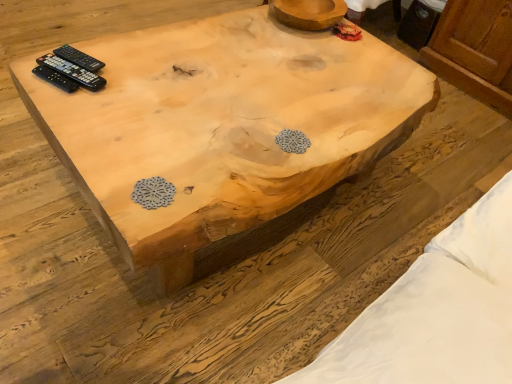
What is the approximate width of black plastic remote controls at upper left, the second remote control when ordered from front to back?

21.29 centimeters.

Measure the distance between point (245,202) and camera.

36.89 inches.

Where is `black plastic remote at upper left, the 3th remote control when ordered from back to front`? This screenshot has width=512, height=384. black plastic remote at upper left, the 3th remote control when ordered from back to front is located at coordinates (56, 79).

The width and height of the screenshot is (512, 384). In order to click on black plastic remote controls at upper left, the second remote control when ordered from front to back in this screenshot , I will do `click(72, 72)`.

Is black plastic remote control at upper left, arranged as the 3th remote control when viewed from the front, taller than natural wood coffee table at center?

Incorrect, the height of black plastic remote control at upper left, arranged as the 3th remote control when viewed from the front, is not larger of that of natural wood coffee table at center.

From the image's perspective, which one is positioned lower, black plastic remote control at upper left, the first remote control positioned from the back, or natural wood coffee table at center?

natural wood coffee table at center, from the image's perspective.

Is black plastic remote control at upper left, arranged as the 3th remote control when viewed from the front, facing away from natural wood coffee table at center?

No, black plastic remote control at upper left, arranged as the 3th remote control when viewed from the front, is not facing the opposite direction of natural wood coffee table at center.

Which object is closer to the camera taking this photo, black plastic remote control at upper left, arranged as the 3th remote control when viewed from the front, or natural wood coffee table at center?

Positioned in front is natural wood coffee table at center.

From the image's perspective, is natural wood coffee table at center on top of black plastic remote control at upper left, arranged as the 3th remote control when viewed from the front?

No, from the image's perspective, natural wood coffee table at center is not above black plastic remote control at upper left, arranged as the 3th remote control when viewed from the front.

From a real-world perspective, which is physically below, natural wood coffee table at center or black plastic remote control at upper left, the first remote control positioned from the back?

In real-world perspective, natural wood coffee table at center is lower.

Considering the sizes of natural wood coffee table at center and black plastic remote control at upper left, arranged as the 3th remote control when viewed from the front, in the image, is natural wood coffee table at center wider or thinner than black plastic remote control at upper left, arranged as the 3th remote control when viewed from the front,?

natural wood coffee table at center is wider than black plastic remote control at upper left, arranged as the 3th remote control when viewed from the front.

Are natural wood coffee table at center and black plastic remote controls at upper left, the second remote control when ordered from front to back, making contact?

natural wood coffee table at center and black plastic remote controls at upper left, the second remote control when ordered from front to back, are clearly separated.

Is point (150, 49) behind point (76, 73)?

Yes, point (150, 49) is behind point (76, 73).

Does natural wood coffee table at center contain black plastic remote controls at upper left, the second remote control when ordered from front to back?

Definitely not — black plastic remote controls at upper left, the second remote control when ordered from front to back, is not inside natural wood coffee table at center.

From a real-world perspective, is black plastic remote at upper left, arranged as the first remote control when viewed from the front, positioned over natural wood coffee table at center based on gravity?

Yes, from a real-world perspective, black plastic remote at upper left, arranged as the first remote control when viewed from the front, is over natural wood coffee table at center

Considering the relative sizes of black plastic remote at upper left, arranged as the first remote control when viewed from the front, and natural wood coffee table at center in the image provided, is black plastic remote at upper left, arranged as the first remote control when viewed from the front, smaller than natural wood coffee table at center?

Correct, black plastic remote at upper left, arranged as the first remote control when viewed from the front, occupies less space than natural wood coffee table at center.

Is black plastic remote at upper left, the 3th remote control when ordered from back to front, oriented towards natural wood coffee table at center?

No, black plastic remote at upper left, the 3th remote control when ordered from back to front, is not turned towards natural wood coffee table at center.

Is black plastic remote controls at upper left, the second remote control from the back, placed right next to black plastic remote control at upper left, arranged as the 3th remote control when viewed from the front?

Yes, black plastic remote controls at upper left, the second remote control from the back, is in contact with black plastic remote control at upper left, arranged as the 3th remote control when viewed from the front.

Considering the relative positions of black plastic remote controls at upper left, the second remote control from the back, and black plastic remote control at upper left, the first remote control positioned from the back, in the image provided, is black plastic remote controls at upper left, the second remote control from the back, to the left or to the right of black plastic remote control at upper left, the first remote control positioned from the back,?

Clearly, black plastic remote controls at upper left, the second remote control from the back, is on the left of black plastic remote control at upper left, the first remote control positioned from the back, in the image.

From a real-world perspective, is black plastic remote controls at upper left, the second remote control when ordered from front to back, beneath black plastic remote control at upper left, the first remote control positioned from the back?

No.

From the image's perspective, is black plastic remote controls at upper left, the second remote control when ordered from front to back, below black plastic remote control at upper left, the first remote control positioned from the back?

Yes.

From the image's perspective, is black plastic remote control at upper left, arranged as the 3th remote control when viewed from the front, above or below black plastic remote at upper left, arranged as the first remote control when viewed from the front?

Clearly, from the image's perspective, black plastic remote control at upper left, arranged as the 3th remote control when viewed from the front, is above black plastic remote at upper left, arranged as the first remote control when viewed from the front.

Are black plastic remote control at upper left, arranged as the 3th remote control when viewed from the front, and black plastic remote at upper left, arranged as the first remote control when viewed from the front, beside each other?

Yes, black plastic remote control at upper left, arranged as the 3th remote control when viewed from the front, is next to black plastic remote at upper left, arranged as the first remote control when viewed from the front.

Is black plastic remote control at upper left, arranged as the 3th remote control when viewed from the front, positioned behind black plastic remote at upper left, arranged as the first remote control when viewed from the front?

Yes.

Would you say black plastic remote control at upper left, arranged as the 3th remote control when viewed from the front, is inside or outside black plastic remote at upper left, arranged as the first remote control when viewed from the front?

black plastic remote control at upper left, arranged as the 3th remote control when viewed from the front, is outside black plastic remote at upper left, arranged as the first remote control when viewed from the front.

From a real-world perspective, between black plastic remote controls at upper left, the second remote control when ordered from front to back, and black plastic remote at upper left, arranged as the first remote control when viewed from the front, who is vertically lower?

In real-world perspective, black plastic remote controls at upper left, the second remote control when ordered from front to back, is lower.

From a real-world perspective, which remote control is the 1st one underneath the black plastic remote at upper left, arranged as the first remote control when viewed from the front? Please provide its 2D coordinates.

[(72, 72)]

Which is more to the left, black plastic remote controls at upper left, the second remote control from the back, or black plastic remote at upper left, arranged as the first remote control when viewed from the front?

A: black plastic remote at upper left, arranged as the first remote control when viewed from the front, is more to the left.

Could black plastic remote at upper left, the 3th remote control when ordered from back to front, be considered to be inside black plastic remote controls at upper left, the second remote control when ordered from front to back?

Definitely not — black plastic remote at upper left, the 3th remote control when ordered from back to front, is not inside black plastic remote controls at upper left, the second remote control when ordered from front to back.

Starting from the natural wood coffee table at center, which remote control is the 1st one to the left? Please provide its 2D coordinates.

[(79, 58)]

You are a GUI agent. You are given a task and a screenshot of the screen. Output one action in this format:
    pyautogui.click(x=<x>, y=<y>)
    Task: Click on the coffee table below the black plastic remote control at upper left, the first remote control positioned from the back (from a real-world perspective)
    
    Given the screenshot: What is the action you would take?
    pyautogui.click(x=224, y=132)

Looking at the image, which one is located further to black plastic remote at upper left, arranged as the first remote control when viewed from the front, black plastic remote control at upper left, the first remote control positioned from the back, or natural wood coffee table at center?

Among the two, natural wood coffee table at center is located further to black plastic remote at upper left, arranged as the first remote control when viewed from the front.

Which object lies further to the anchor point natural wood coffee table at center, black plastic remote controls at upper left, the second remote control when ordered from front to back, or black plastic remote control at upper left, the first remote control positioned from the back?

Among the two, black plastic remote control at upper left, the first remote control positioned from the back, is located further to natural wood coffee table at center.

Based on their spatial positions, is black plastic remote at upper left, the 3th remote control when ordered from back to front, or black plastic remote controls at upper left, the second remote control when ordered from front to back, further from natural wood coffee table at center?

Based on the image, black plastic remote at upper left, the 3th remote control when ordered from back to front, appears to be further to natural wood coffee table at center.

When comparing their distances from black plastic remote at upper left, the 3th remote control when ordered from back to front, does natural wood coffee table at center or black plastic remote controls at upper left, the second remote control when ordered from front to back, seem further?

Based on the image, natural wood coffee table at center appears to be further to black plastic remote at upper left, the 3th remote control when ordered from back to front.

Considering their positions, is black plastic remote at upper left, arranged as the first remote control when viewed from the front, positioned further to natural wood coffee table at center than black plastic remote control at upper left, arranged as the 3th remote control when viewed from the front?

The object further to natural wood coffee table at center is black plastic remote at upper left, arranged as the first remote control when viewed from the front.

From the image, which object appears to be farther from black plastic remote control at upper left, the first remote control positioned from the back, black plastic remote controls at upper left, the second remote control when ordered from front to back, or black plastic remote at upper left, the 3th remote control when ordered from back to front?

Based on the image, black plastic remote at upper left, the 3th remote control when ordered from back to front, appears to be further to black plastic remote control at upper left, the first remote control positioned from the back.

In the scene shown: Looking at the image, which one is located closer to black plastic remote control at upper left, the first remote control positioned from the back, natural wood coffee table at center or black plastic remote controls at upper left, the second remote control when ordered from front to back?

black plastic remote controls at upper left, the second remote control when ordered from front to back, lies closer to black plastic remote control at upper left, the first remote control positioned from the back, than the other object.

Which object lies further to the anchor point natural wood coffee table at center, black plastic remote control at upper left, the first remote control positioned from the back, or black plastic remote at upper left, the 3th remote control when ordered from back to front?

black plastic remote at upper left, the 3th remote control when ordered from back to front, is further to natural wood coffee table at center.

Find the location of a particular element. The image size is (512, 384). remote control positioned between black plastic remote at upper left, the 3th remote control when ordered from back to front, and black plastic remote control at upper left, the first remote control positioned from the back, from near to far is located at coordinates (72, 72).

Locate an element on the screen. This screenshot has height=384, width=512. remote control between black plastic remote controls at upper left, the second remote control from the back, and natural wood coffee table at center from left to right is located at coordinates (79, 58).